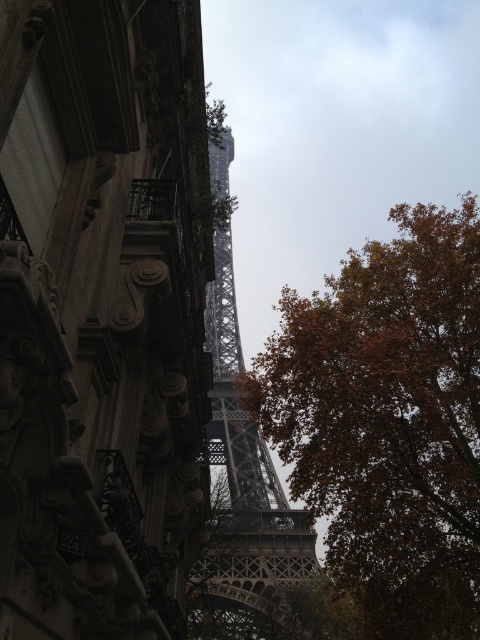
Question: Which object appears farthest from the camera in this image?

Choices:
 (A) metallic gray eiffel tower at center
 (B) brown leafy tree at center

Answer: (A)

Question: Observing the image, what is the correct spatial positioning of brown leafy tree at center in reference to metallic gray eiffel tower at center?

Choices:
 (A) above
 (B) below

Answer: (B)

Question: Observing the image, what is the correct spatial positioning of brown leafy tree at center in reference to metallic gray eiffel tower at center?

Choices:
 (A) left
 (B) right

Answer: (B)

Question: Which object is farther from the camera taking this photo?

Choices:
 (A) metallic gray eiffel tower at center
 (B) brown leafy tree at center

Answer: (A)

Question: Is brown leafy tree at center smaller than metallic gray eiffel tower at center?

Choices:
 (A) no
 (B) yes

Answer: (B)